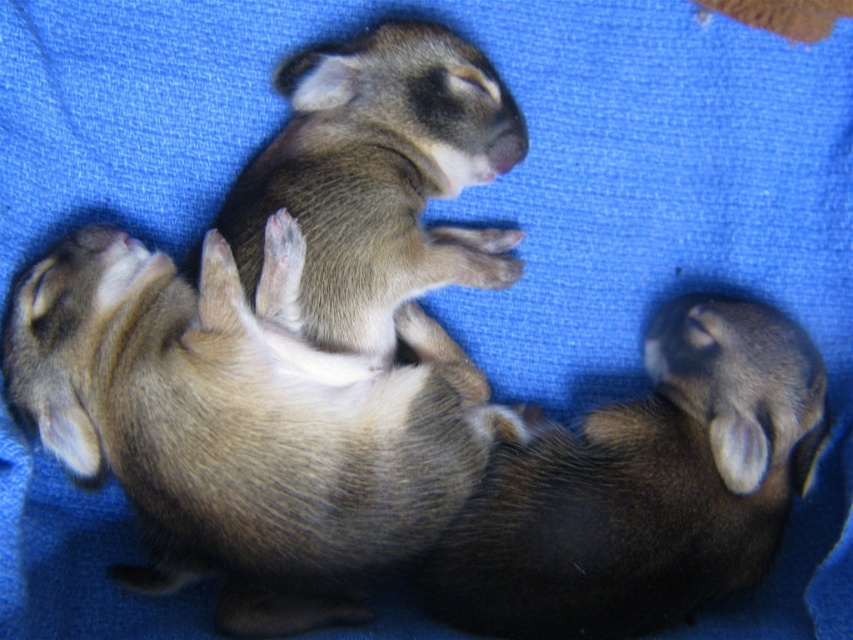
You are a toy maker who wants to place a small stuffed toy between the brown fuzzy puppy at center and the brown fuzzy rabbit at lower right. The toy is 10 inches long. Do you think there is enough space between them to fit the toy?

The distance between the brown fuzzy puppy at center and the brown fuzzy rabbit at lower right is 9.11 inches. Since the toy is 10 inches long, there is not enough space to fit it between them.

You are a photographer trying to capture a closeup of the brown fuzzy puppy at center. The camera is set at a focal length of 100mm. If the puppy is located at coordinates point 0.656, 0.291, what is the best way to frame the shot?

The brown fuzzy puppy at center is located at point (247, 419), so the photographer should position the camera to focus on those coordinates to ensure the puppy is centered in the frame.